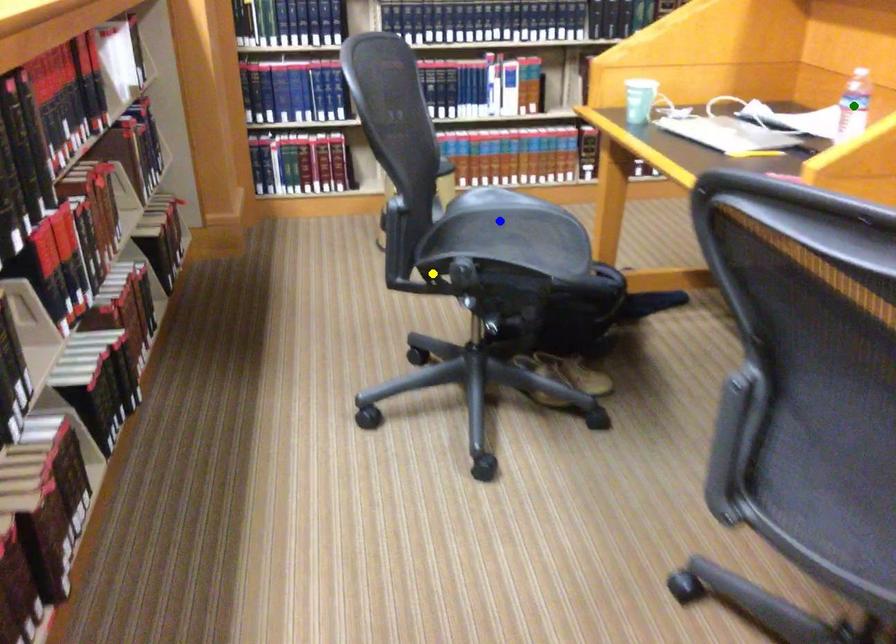
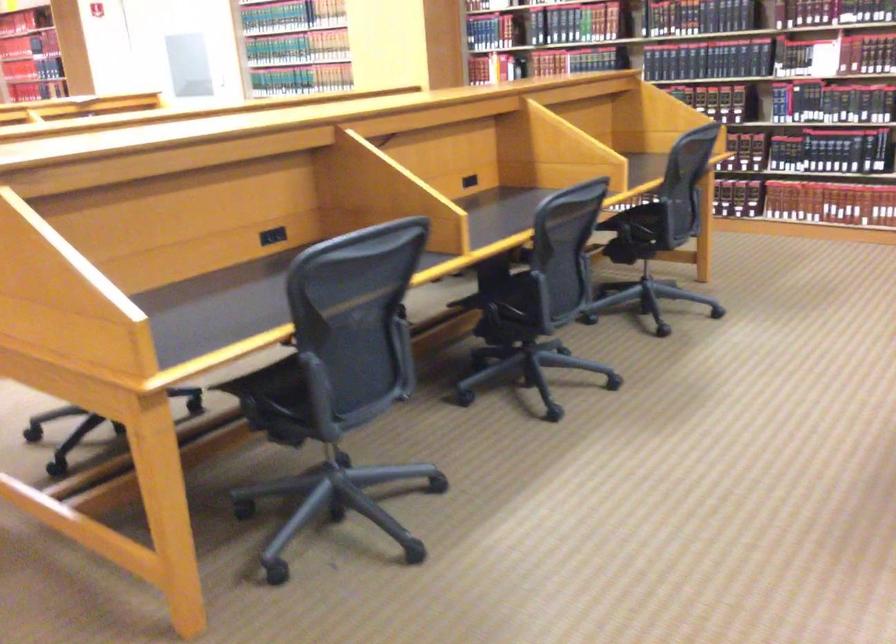
I am providing you with two images of the same scene from different viewpoints. Three points are marked in image1. Which point corresponds to a part or object that is occluded in image2?In image1, three points are marked. Which of them correspond to a part or object that is occluded in image2?Among the three points shown in image1, which one corresponds to a part or object that is no longer visible due to occlusion in image2?

Invisible in image2: blue point, green point, yellow point.